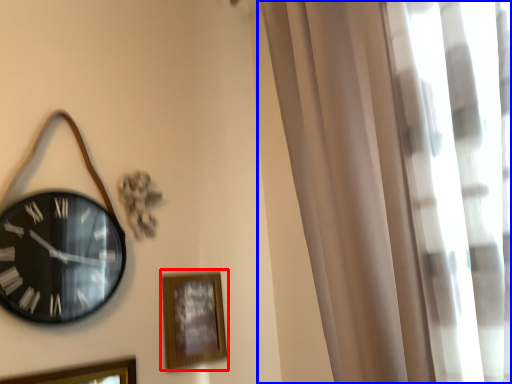
Question: Which point is closer to the camera, picture frame (highlighted by a red box) or curtain (highlighted by a blue box)?

Choices:
 (A) picture frame
 (B) curtain

Answer: (B)